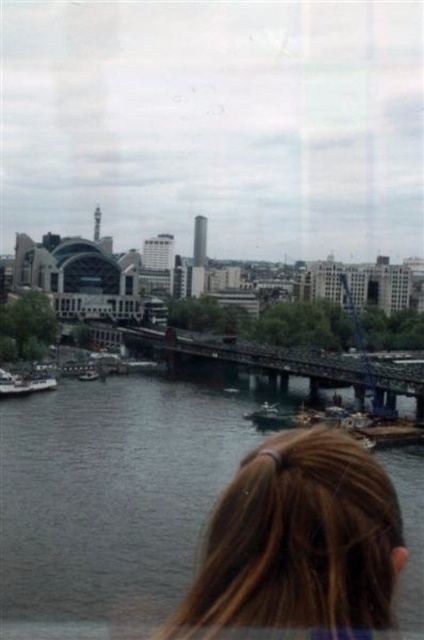
Question: Among these points, which one is nearest to the camera?

Choices:
 (A) (103, 429)
 (B) (89, 378)

Answer: (A)

Question: Does dark gray water at center lie behind white matte boat at lower left?

Choices:
 (A) no
 (B) yes

Answer: (A)

Question: Among these points, which one is nearest to the camera?

Choices:
 (A) (251, 561)
 (B) (44, 371)
 (C) (169, 502)
 (D) (329, 358)

Answer: (A)

Question: Is dark gray water at center smaller than dark brown metal bridge at center?

Choices:
 (A) yes
 (B) no

Answer: (B)

Question: Which object appears farthest from the camera in this image?

Choices:
 (A) brown hair at lower center
 (B) white matte boat at lower left
 (C) dark gray water at center
 (D) metallic silver boat at center

Answer: (D)

Question: Is brown hair at lower center above dark brown metal bridge at center?

Choices:
 (A) no
 (B) yes

Answer: (A)